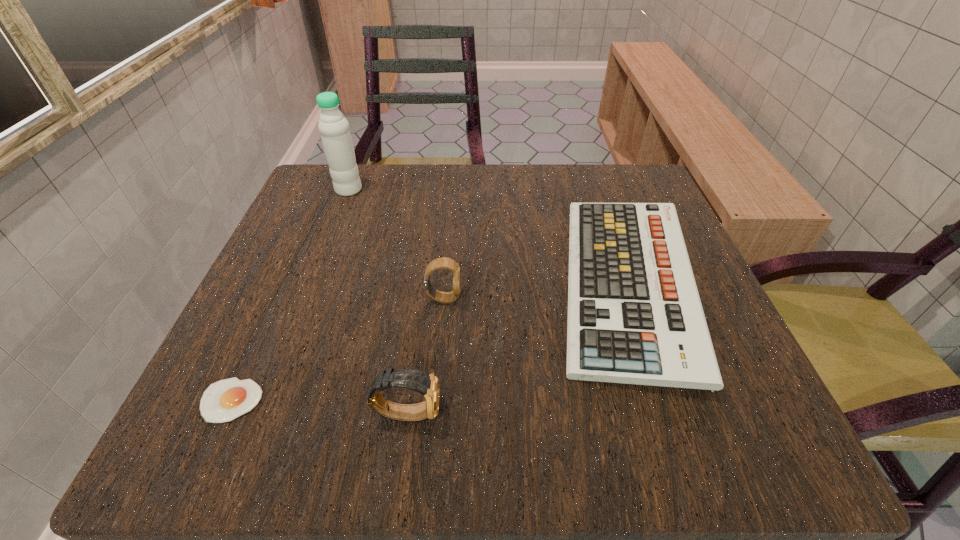
This screenshot has width=960, height=540. I want to click on water bottle, so click(334, 128).

This screenshot has height=540, width=960. I want to click on the tallest object, so click(334, 128).

The height and width of the screenshot is (540, 960). In order to click on the nearer watch in this screenshot , I will do `click(427, 384)`.

Where is `the farther watch`? This screenshot has width=960, height=540. the farther watch is located at coordinates (446, 263).

The height and width of the screenshot is (540, 960). I want to click on computer keyboard, so click(x=634, y=313).

At what (x,y) coordinates should I click in order to perform the action: click on the rightmost object. Please return your answer as a coordinate pair (x, y). This screenshot has height=540, width=960. Looking at the image, I should click on (634, 313).

Identify the location of egg yolk. The height and width of the screenshot is (540, 960). (225, 400).

The image size is (960, 540). Identify the location of vacant area situated 0.340m on the front of the farthest object. (300, 316).

This screenshot has height=540, width=960. I want to click on blank space located 0.130m on the face of the nearer watch, so click(x=538, y=413).

Find the location of a particular element. The width and height of the screenshot is (960, 540). free location located on the face of the farther watch is located at coordinates (628, 299).